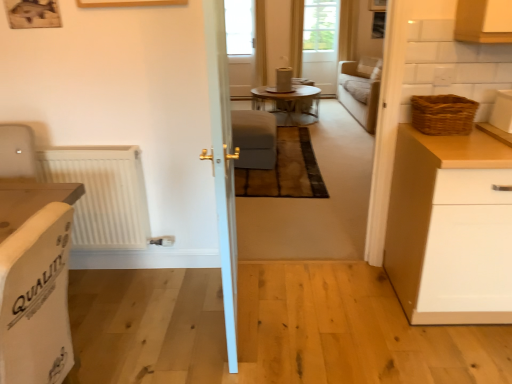
Locate an element on the screen. This screenshot has height=384, width=512. vacant location below white glossy door at center (from a real-world perspective) is located at coordinates (229, 316).